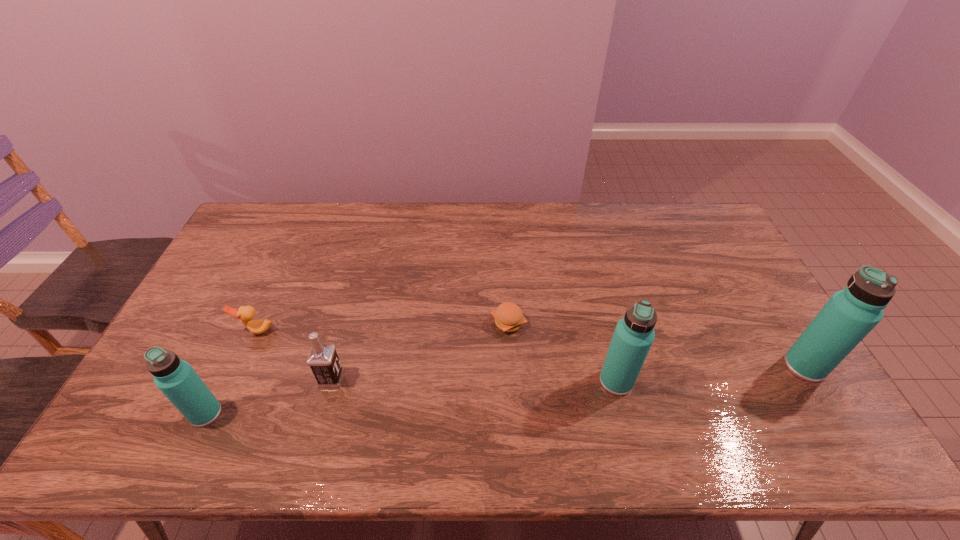
Please mark a free spot for a new thermos_bottle to balance the arrangement. Please provide its 2D coordinates. Your answer should be formatted as a tuple, i.e. [(x, y)], where the tuple contains the x and y coordinates of a point satisfying the conditions above.

[(417, 397)]